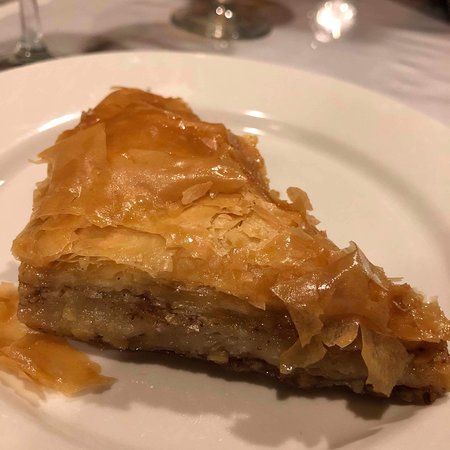
At what (x,y) coordinates should I click in order to perform the action: click on white tablecloth. Please return your answer as a coordinate pair (x, y). The image size is (450, 450). Looking at the image, I should click on (380, 75).